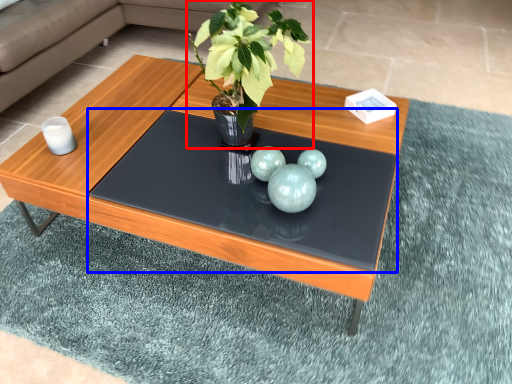
Question: Which object is further to the camera taking this photo, houseplant (highlighted by a red box) or glass table (highlighted by a blue box)?

Choices:
 (A) houseplant
 (B) glass table

Answer: (B)